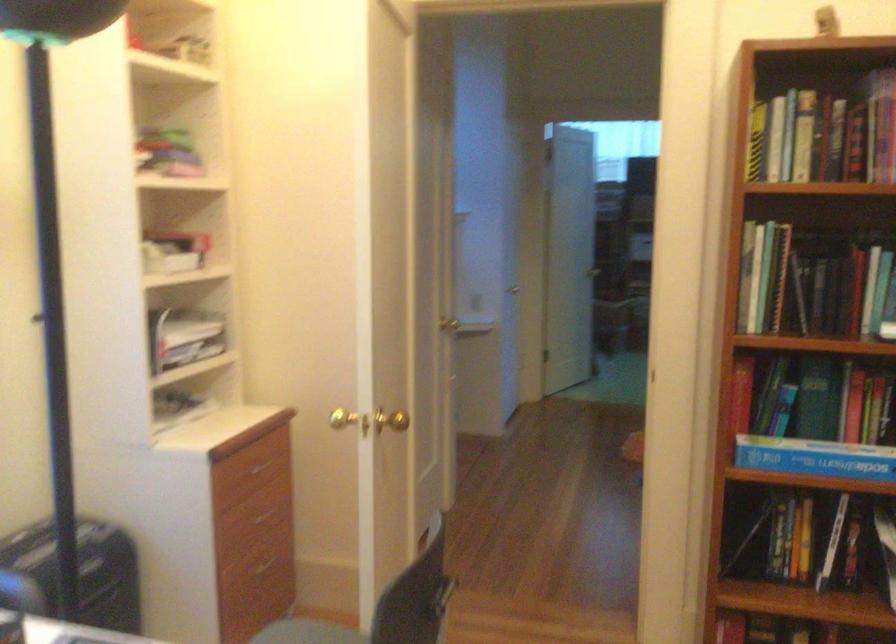
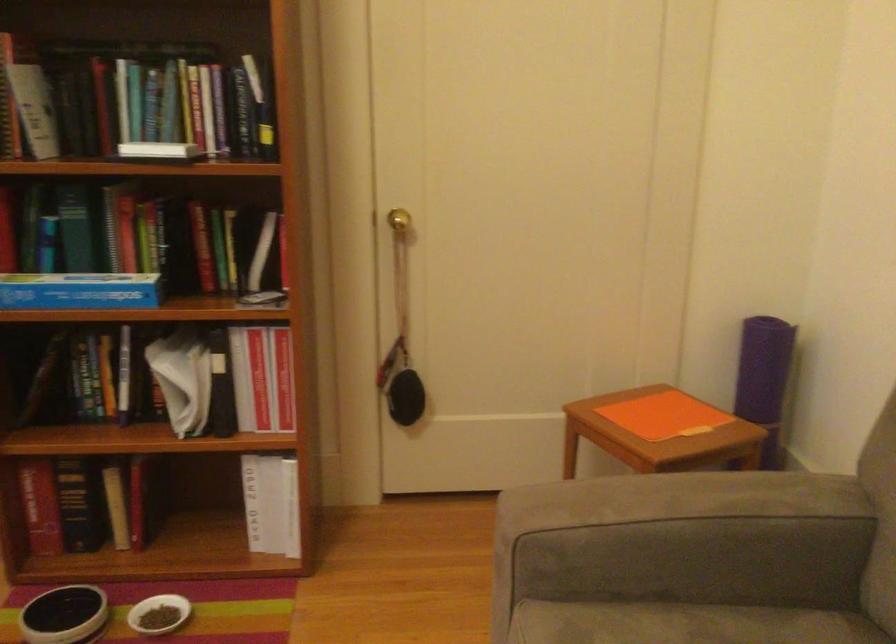
Question: What movement of the cameraman would produce the second image?

Choices:
 (A) Left
 (B) Right
 (C) Forward
 (D) Backward

Answer: (B)